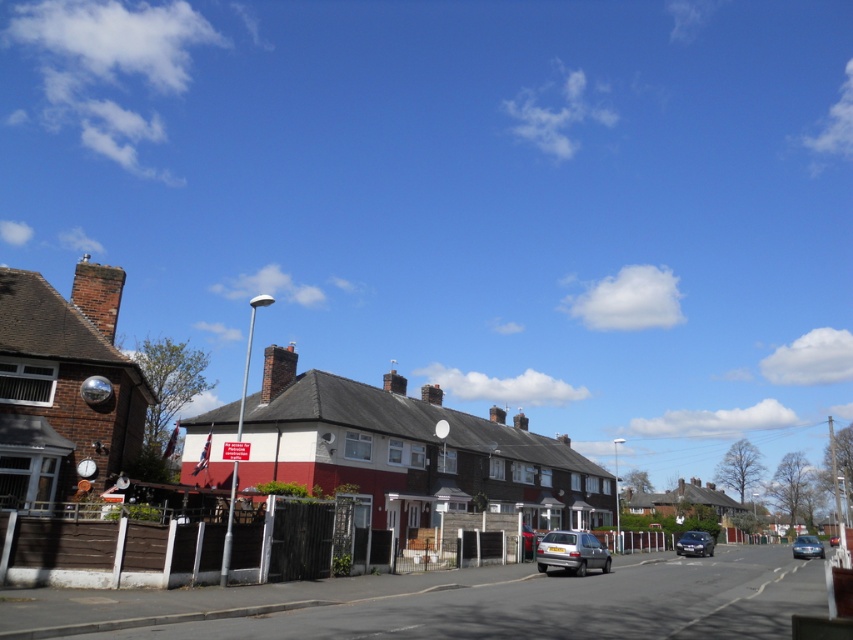
Is silver metallic hatchback at center to the left of metallic blue sedan at right from the viewer's perspective?

Yes, silver metallic hatchback at center is to the left of metallic blue sedan at right.

Who is higher up, silver metallic hatchback at center or metallic blue sedan at right?

silver metallic hatchback at center is higher up.

What do you see at coordinates (572, 552) in the screenshot? This screenshot has width=853, height=640. I see `silver metallic hatchback at center` at bounding box center [572, 552].

At what (x,y) coordinates should I click in order to perform the action: click on silver metallic hatchback at center. Please return your answer as a coordinate pair (x, y). Image resolution: width=853 pixels, height=640 pixels. Looking at the image, I should click on (572, 552).

Does shiny black sedan at center-right have a larger size compared to metallic blue sedan at right?

Incorrect, shiny black sedan at center-right is not larger than metallic blue sedan at right.

What do you see at coordinates (694, 544) in the screenshot?
I see `shiny black sedan at center-right` at bounding box center [694, 544].

Locate an element on the screen. The width and height of the screenshot is (853, 640). shiny black sedan at center-right is located at coordinates (694, 544).

Which of these two, silver metallic hatchback at center or shiny red car at center, stands shorter?

silver metallic hatchback at center is shorter.

Does silver metallic hatchback at center appear under shiny red car at center?

No.

The height and width of the screenshot is (640, 853). I want to click on silver metallic hatchback at center, so click(572, 552).

I want to click on silver metallic hatchback at center, so click(x=572, y=552).